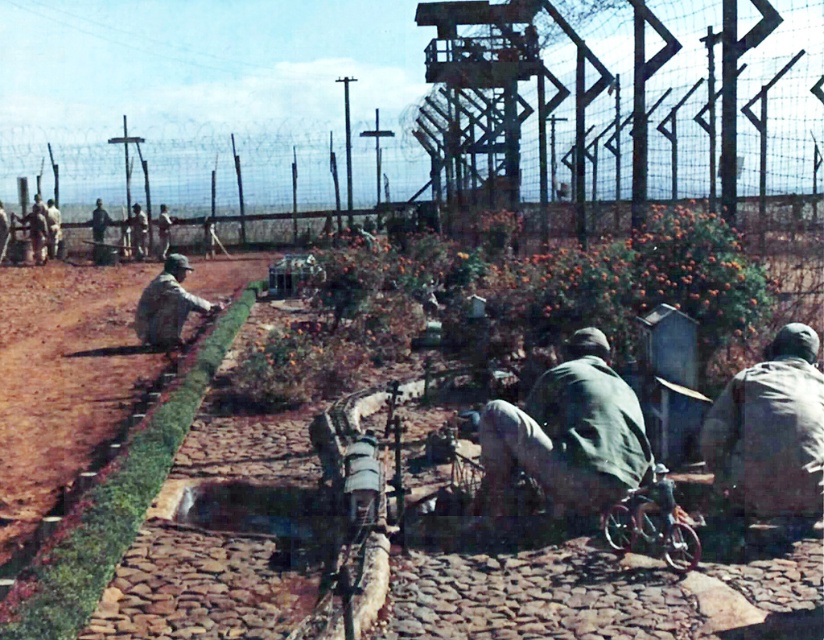
You are a soldier who needs to pass a package to another soldier. You are wearing the green matte jacket at center and the other soldier is wearing the camouflage fabric uniform at lower right. Can you directly hand the package to them without moving closer than 2 feet?

The distance between the green matte jacket at center and the camouflage fabric uniform at lower right is 29.61 inches, which is less than 2 feet. Therefore, you can directly hand the package to them without needing to move closer.

You are a soldier in the military setting. You see a green matte jacket at center and a camouflage fabric uniform at center. Which clothing item is nearer to you?

The green matte jacket at center is closer to the viewer than the camouflage fabric uniform at center.